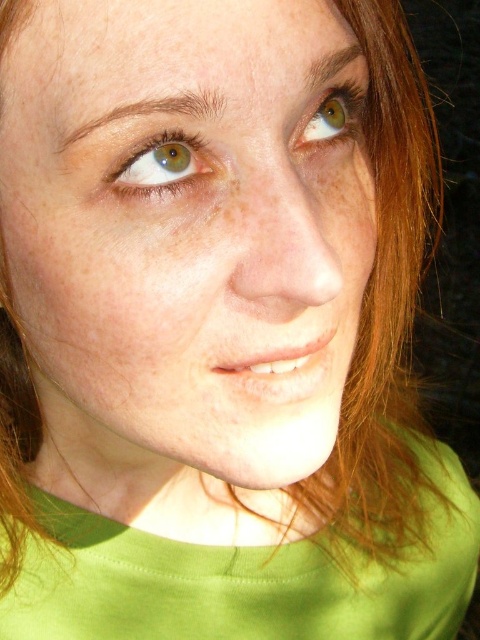
Does smooth skin face at center have a greater height compared to green matte eye at upper right?

Yes, smooth skin face at center is taller than green matte eye at upper right.

Does smooth skin face at center have a larger size compared to green matte eye at upper right?

Yes.

Is point (175, 12) less distant than point (343, 125)?

Yes.

The height and width of the screenshot is (640, 480). I want to click on smooth skin face at center, so click(x=183, y=236).

Who is more distant from viewer, (207, 147) or (183, 172)?

The point (183, 172) is more distant.

Does smooth skin face at center lie in front of matte green eye at upper left?

Yes, smooth skin face at center is closer to the viewer.

This screenshot has height=640, width=480. What are the coordinates of `smooth skin face at center` in the screenshot? It's located at (183, 236).

Can you confirm if matte green eye at upper left is smaller than green matte eye at upper right?

Yes, matte green eye at upper left is smaller than green matte eye at upper right.

Can you confirm if matte green eye at upper left is positioned above green matte eye at upper right?

No.

Does point (201, 163) lie in front of point (327, 106)?

Yes.

Identify the location of matte green eye at upper left. (163, 164).